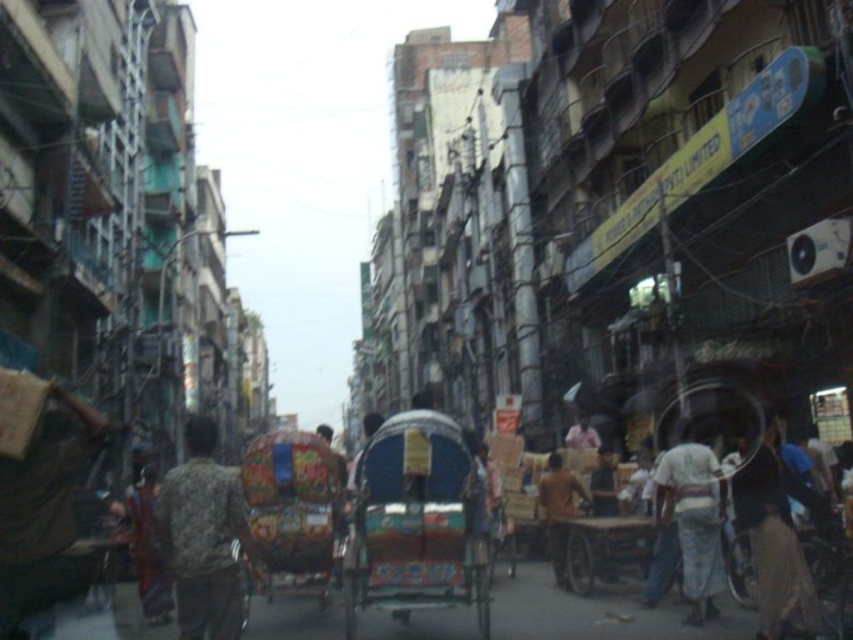
You are a delivery person trying to reach the brown fabric bag at left which is your package. The decorative painted cart at center is blocking your path. Can you move around it to get to the bag?

The brown fabric bag at left is behind decorative painted cart at center, so you can move around the decorative painted cart at center to reach the brown fabric bag at left.

You are standing on the street in the image and want to take a photo of both the point at coordinates [689,552] and the point at coordinates [566,525]. Which point should you focus on first to ensure both are in clear view?

You should focus on point [689,552] first because it is closer to the camera than point [566,525]. By focusing on the closer point, the farther point will also be in focus due to the depth of field.

You are a delivery person trying to navigate through the narrow street. You see a decorative painted cart at center and a brown fabric bag at left. Which object is wider, and how might this affect your path?

The decorative painted cart at center is wider than the brown fabric bag at left. This means the cart may require more space to maneuver around, so you should plan your path accordingly to avoid collisions.